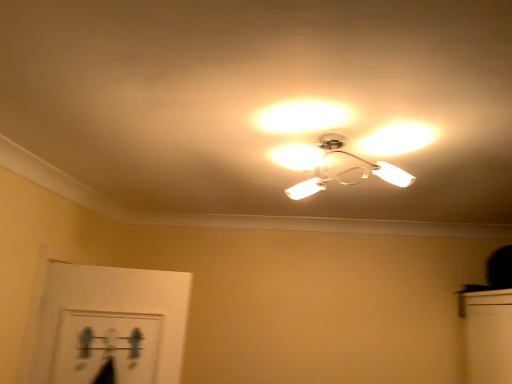
In order to click on white glossy light fixture at center in this screenshot , I will do `click(343, 169)`.

What do you see at coordinates (343, 169) in the screenshot? I see `white glossy light fixture at center` at bounding box center [343, 169].

Locate an element on the screen. white glossy light fixture at center is located at coordinates (343, 169).